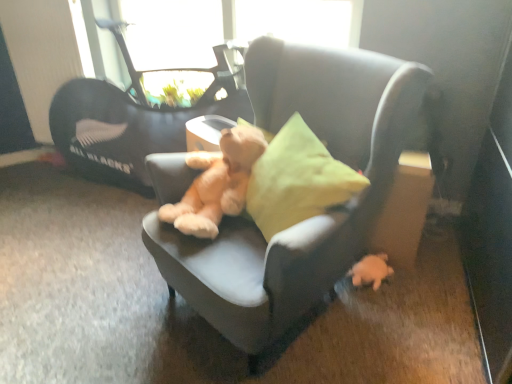
Question: From the image's perspective, is soft beige teddy bear at center above or below soft gray chair at center?

Choices:
 (A) below
 (B) above

Answer: (B)

Question: Visually, is soft beige teddy bear at center positioned to the left or to the right of soft gray chair at center?

Choices:
 (A) left
 (B) right

Answer: (A)

Question: Which object is positioned closest to the soft beige teddy bear at center?

Choices:
 (A) black fabric baby carriage at upper left
 (B) transparent glass window screen at upper center
 (C) white plush toy at lower right
 (D) soft gray chair at center

Answer: (D)

Question: Which is nearer to the transparent glass window screen at upper center?

Choices:
 (A) black fabric baby carriage at upper left
 (B) soft gray chair at center
 (C) soft beige teddy bear at center
 (D) white plush toy at lower right

Answer: (A)